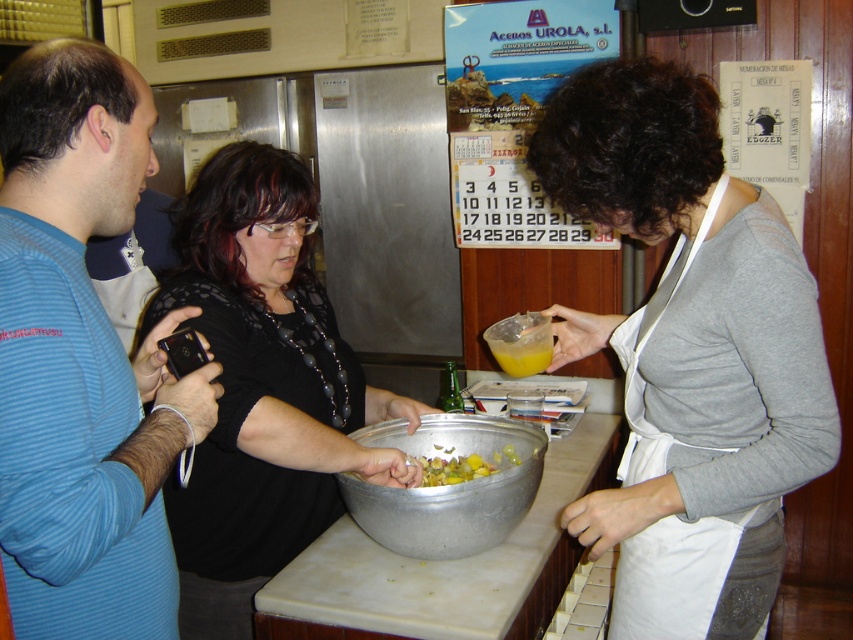
You are a chef standing in the kitchen and need to hand a recipe card to the person wearing the blue striped shirt at left. The recipe card is in your apron pocket, which is on the white fabric apron at center. Can you reach them without moving from your current position?

The blue striped shirt at left and white fabric apron at center are 30.85 inches apart. Since the distance between them is less than the typical reaching distance of about 3 feet, you can likely hand the recipe card to the person without moving.

You are a person standing in the kitchen and want to hand a recipe book to both the blue striped shirt at left and the white fabric apron at center. Which one can you reach without moving your position?

The blue striped shirt at left is located above the white fabric apron at center, so you can reach the blue striped shirt at left without moving your position, but you might need to move to reach the white fabric apron at center.

Based on the scene description, can you determine if the black matte shirt at center is positioned higher than the metallic bowl at center?

Yes, the black matte shirt at center is located above the metallic bowl at center, so it is positioned higher.